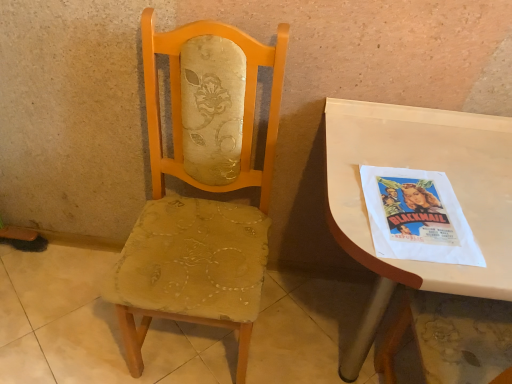
Question: Are worn fabric chair at center and matte yellow fabric chair at center beside each other?

Choices:
 (A) yes
 (B) no

Answer: (B)

Question: Is worn fabric chair at center aimed at matte yellow fabric chair at center?

Choices:
 (A) no
 (B) yes

Answer: (A)

Question: From a real-world perspective, is worn fabric chair at center over matte yellow fabric chair at center?

Choices:
 (A) yes
 (B) no

Answer: (B)

Question: Considering the relative positions of worn fabric chair at center and matte yellow fabric chair at center in the image provided, is worn fabric chair at center to the left of matte yellow fabric chair at center from the viewer's perspective?

Choices:
 (A) yes
 (B) no

Answer: (A)

Question: Can we say worn fabric chair at center lies outside matte yellow fabric chair at center?

Choices:
 (A) no
 (B) yes

Answer: (B)

Question: Can you confirm if worn fabric chair at center is wider than matte yellow fabric chair at center?

Choices:
 (A) no
 (B) yes

Answer: (B)

Question: Considering the relative positions of white glossy desk at right and worn fabric chair at center in the image provided, is white glossy desk at right in front of worn fabric chair at center?

Choices:
 (A) no
 (B) yes

Answer: (B)

Question: Would you consider white glossy desk at right to be distant from worn fabric chair at center?

Choices:
 (A) no
 (B) yes

Answer: (A)

Question: Is white glossy desk at right smaller than worn fabric chair at center?

Choices:
 (A) no
 (B) yes

Answer: (A)

Question: Is white glossy desk at right further to the viewer compared to worn fabric chair at center?

Choices:
 (A) no
 (B) yes

Answer: (A)

Question: Does white glossy desk at right have a lesser height compared to worn fabric chair at center?

Choices:
 (A) no
 (B) yes

Answer: (A)

Question: From the image's perspective, is white glossy desk at right under worn fabric chair at center?

Choices:
 (A) no
 (B) yes

Answer: (A)

Question: Considering the relative sizes of white glossy desk at right and matte yellow fabric chair at center in the image provided, is white glossy desk at right wider than matte yellow fabric chair at center?

Choices:
 (A) no
 (B) yes

Answer: (B)